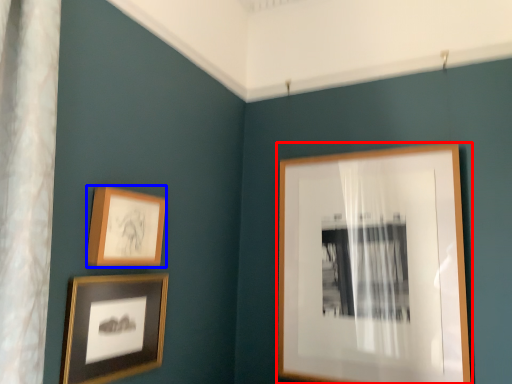
Question: Which of the following is the closest to the observer, picture frame (highlighted by a red box) or picture frame (highlighted by a blue box)?

Choices:
 (A) picture frame
 (B) picture frame

Answer: (B)